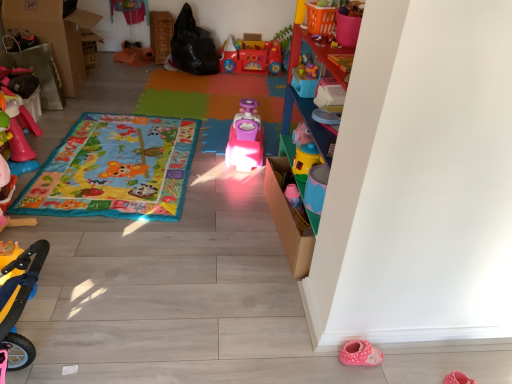
Where is `unoccupied region to the right of rubberized yellow scooter at left, the fourth toy viewed from the front`? This screenshot has width=512, height=384. unoccupied region to the right of rubberized yellow scooter at left, the fourth toy viewed from the front is located at coordinates (45, 201).